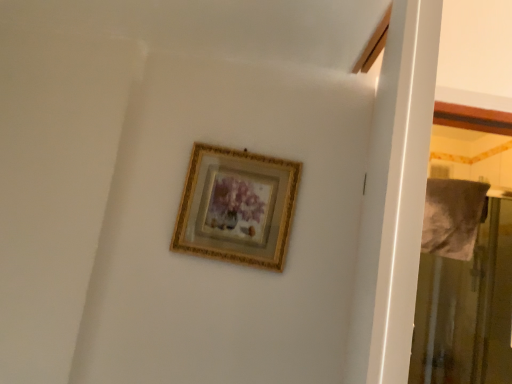
This screenshot has width=512, height=384. Describe the element at coordinates (237, 207) in the screenshot. I see `gold/gilded picture frame at upper center` at that location.

Locate an element on the screen. This screenshot has width=512, height=384. gold/gilded picture frame at upper center is located at coordinates (237, 207).

Describe the element at coordinates (467, 308) in the screenshot. I see `transparent plastic screen door at right` at that location.

What is the approximate width of transparent plastic screen door at right?

It is 51.41 centimeters.

This screenshot has height=384, width=512. What are the coordinates of `transparent plastic screen door at right` in the screenshot? It's located at (467, 308).

You are a GUI agent. You are given a task and a screenshot of the screen. Output one action in this format:
    pyautogui.click(x=<x>, y=<y>)
    Task: Click on the gold/gilded picture frame at upper center
    
    Given the screenshot: What is the action you would take?
    pyautogui.click(x=237, y=207)

Does transparent plastic screen door at right appear on the left side of gold/gilded picture frame at upper center?

No.

Considering the positions of objects transparent plastic screen door at right and gold/gilded picture frame at upper center in the image provided, who is in front, transparent plastic screen door at right or gold/gilded picture frame at upper center?

Positioned in front is gold/gilded picture frame at upper center.

Is point (481, 224) less distant than point (295, 186)?

No, (481, 224) is further to viewer.

From the image's perspective, which is below, transparent plastic screen door at right or gold/gilded picture frame at upper center?

transparent plastic screen door at right, from the image's perspective.

From a real-world perspective, who is located lower, transparent plastic screen door at right or gold/gilded picture frame at upper center?

In real-world perspective, transparent plastic screen door at right is lower.

Does transparent plastic screen door at right have a lesser width compared to gold/gilded picture frame at upper center?

No, transparent plastic screen door at right is not thinner than gold/gilded picture frame at upper center.

From their relative heights in the image, would you say transparent plastic screen door at right is taller or shorter than gold/gilded picture frame at upper center?

Considering their sizes, transparent plastic screen door at right has more height than gold/gilded picture frame at upper center.

Can you confirm if transparent plastic screen door at right is bigger than gold/gilded picture frame at upper center?

Yes.

Is transparent plastic screen door at right inside the boundaries of gold/gilded picture frame at upper center, or outside?

transparent plastic screen door at right lies outside gold/gilded picture frame at upper center.

Is transparent plastic screen door at right not near gold/gilded picture frame at upper center?

Indeed, transparent plastic screen door at right is not near gold/gilded picture frame at upper center.

Is transparent plastic screen door at right looking in the opposite direction of gold/gilded picture frame at upper center?

No, transparent plastic screen door at right is not facing away from gold/gilded picture frame at upper center.

How distant is transparent plastic screen door at right from gold/gilded picture frame at upper center?

transparent plastic screen door at right is 4.90 feet away from gold/gilded picture frame at upper center.

Identify the location of picture frame located above the transparent plastic screen door at right (from the image's perspective). Image resolution: width=512 pixels, height=384 pixels. (237, 207).

Is gold/gilded picture frame at upper center to the right of transparent plastic screen door at right from the viewer's perspective?

No.

Between gold/gilded picture frame at upper center and transparent plastic screen door at right, which one is positioned behind?

Positioned behind is transparent plastic screen door at right.

Between point (296, 175) and point (415, 334), which one is positioned in front?

The point (296, 175) is more forward.

From the image's perspective, is gold/gilded picture frame at upper center positioned above or below transparent plastic screen door at right?

gold/gilded picture frame at upper center is situated higher than transparent plastic screen door at right in the image.

From a real-world perspective, between gold/gilded picture frame at upper center and transparent plastic screen door at right, who is vertically lower?

From a 3D spatial view, transparent plastic screen door at right is below.

Between gold/gilded picture frame at upper center and transparent plastic screen door at right, which one has larger width?

With larger width is transparent plastic screen door at right.

Is gold/gilded picture frame at upper center taller than transparent plastic screen door at right?

No.

Based on their sizes in the image, would you say gold/gilded picture frame at upper center is bigger or smaller than transparent plastic screen door at right?

gold/gilded picture frame at upper center is smaller than transparent plastic screen door at right.

Is transparent plastic screen door at right a part of gold/gilded picture frame at upper center?

That's incorrect, transparent plastic screen door at right is not inside gold/gilded picture frame at upper center.

Is gold/gilded picture frame at upper center far from transparent plastic screen door at right?

Indeed, gold/gilded picture frame at upper center is not near transparent plastic screen door at right.

Is gold/gilded picture frame at upper center oriented away from transparent plastic screen door at right?

No, gold/gilded picture frame at upper center's orientation is not away from transparent plastic screen door at right.

What's the angular difference between gold/gilded picture frame at upper center and transparent plastic screen door at right's facing directions?

gold/gilded picture frame at upper center and transparent plastic screen door at right are facing 10.5 degrees away from each other.

Measure the distance from gold/gilded picture frame at upper center to transparent plastic screen door at right.

gold/gilded picture frame at upper center is 4.90 feet from transparent plastic screen door at right.

Where is `screen door behind the gold/gilded picture frame at upper center`? screen door behind the gold/gilded picture frame at upper center is located at coordinates (467, 308).

The height and width of the screenshot is (384, 512). I want to click on screen door on the right of the gold/gilded picture frame at upper center, so click(467, 308).

Locate an element on the screen. The height and width of the screenshot is (384, 512). screen door that appears behind the gold/gilded picture frame at upper center is located at coordinates (467, 308).